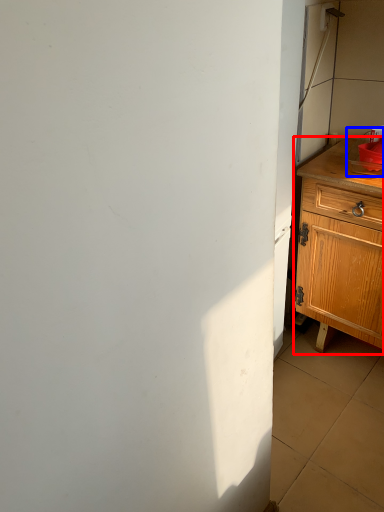
Question: Which object appears closest to the camera in this image, chest of drawers (highlighted by a red box) or sink (highlighted by a blue box)?

Choices:
 (A) chest of drawers
 (B) sink

Answer: (A)